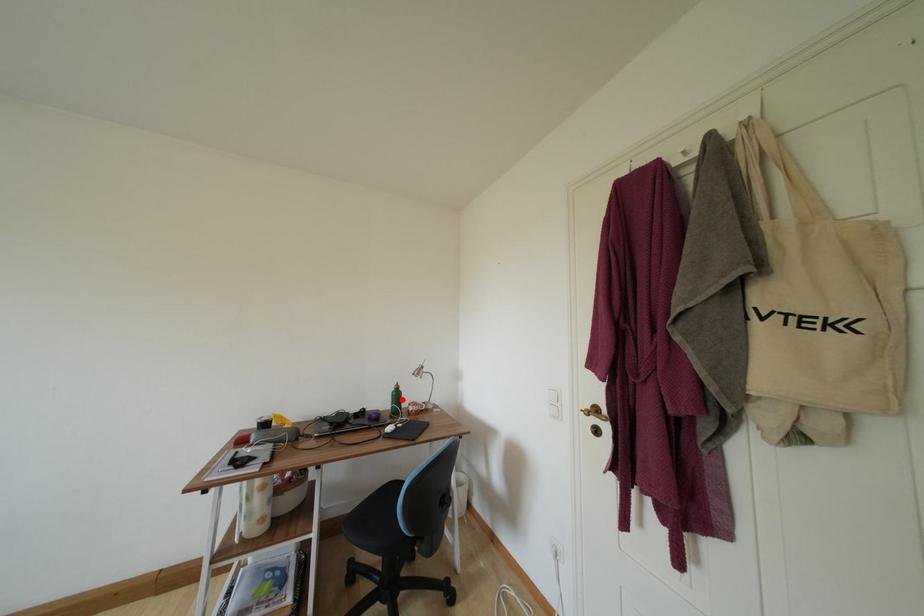
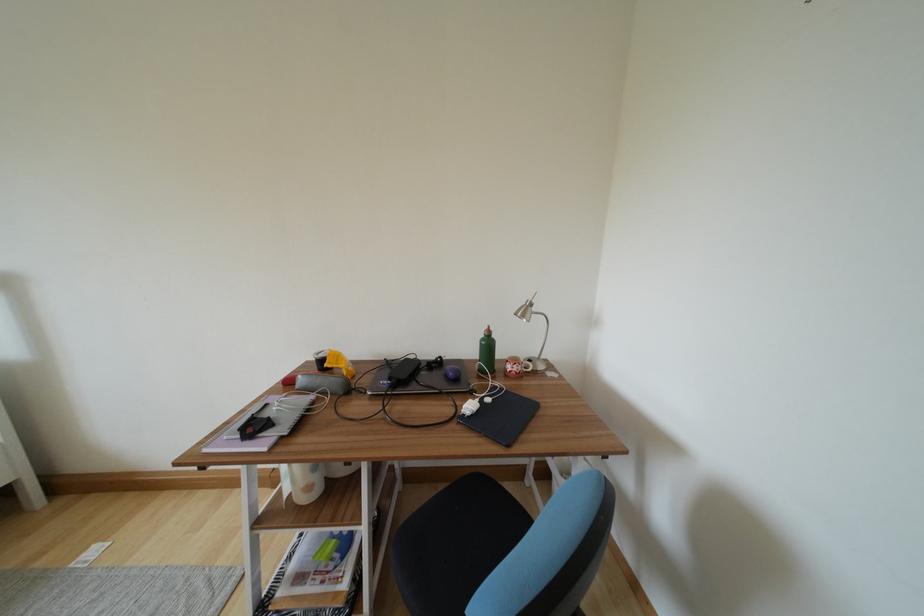
Where in the second image is the point corresponding to the highlighted location from the first image?

(493, 349)